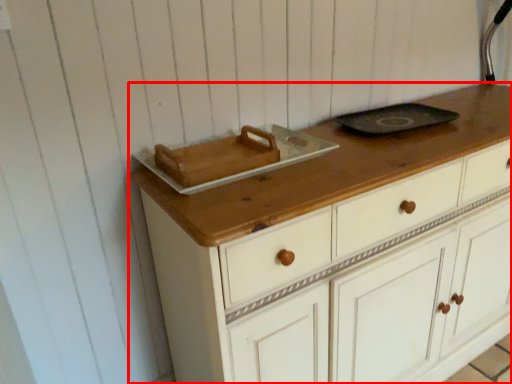
Question: In this image, where is chest of drawers (annotated by the red box) located relative to appliance?

Choices:
 (A) right
 (B) left

Answer: (A)